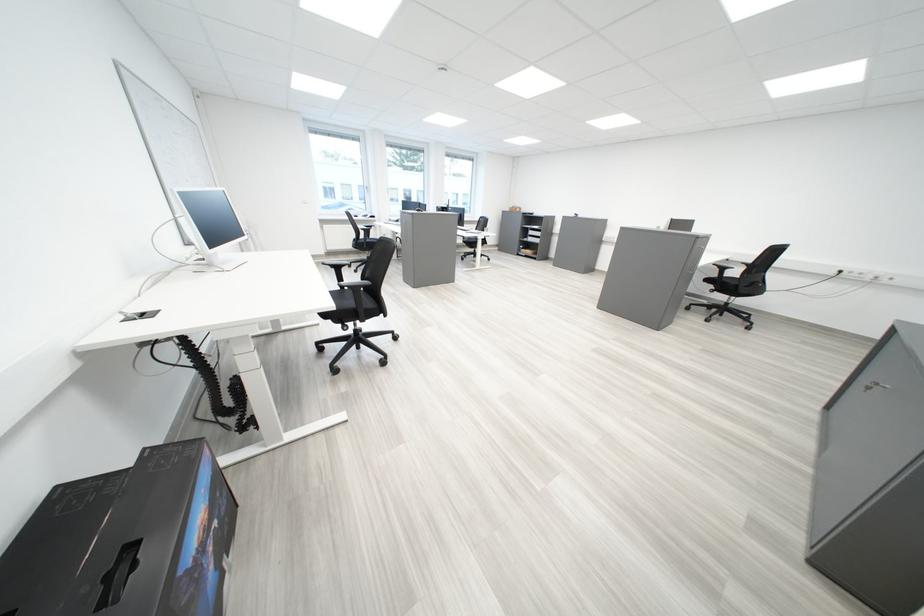
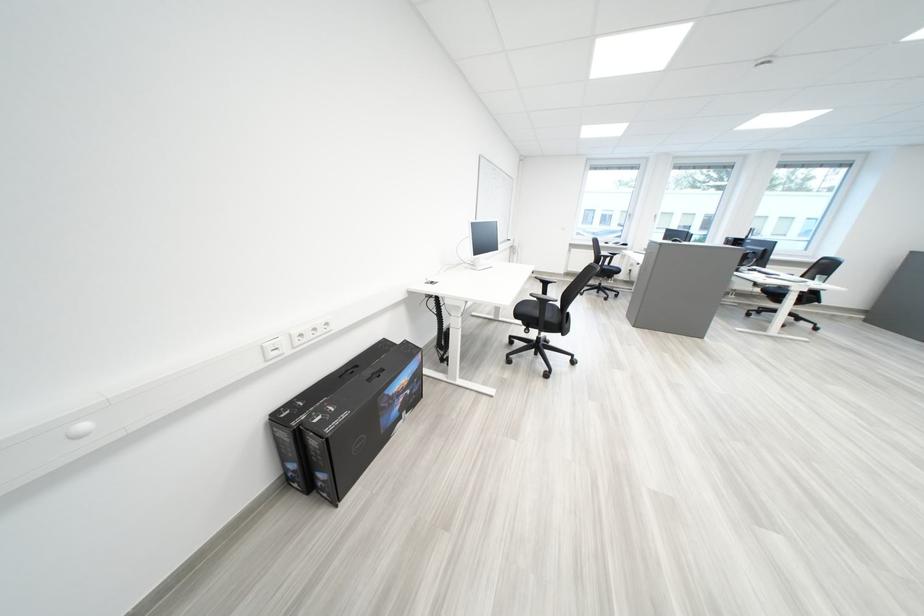
The point at (336, 265) is marked in the first image. Where is the corresponding point in the second image?

(550, 280)